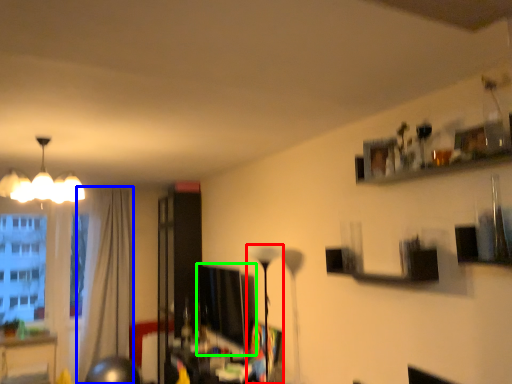
Question: Considering the real-world distances, which object is farthest from lamp (highlighted by a red box)? curtain (highlighted by a blue box) or computer monitor (highlighted by a green box)?

Choices:
 (A) curtain
 (B) computer monitor

Answer: (A)